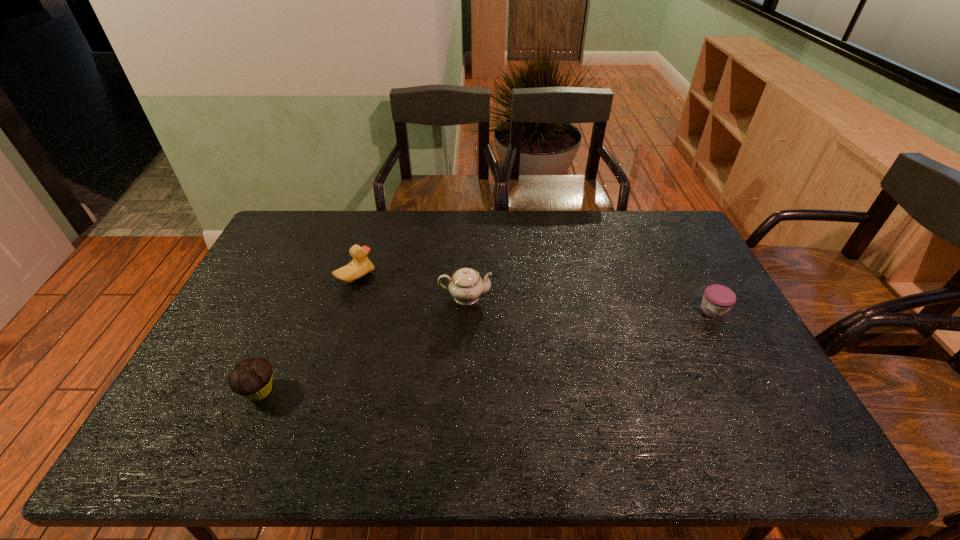
I want to click on object that is at the left edge, so pos(252,377).

Find the location of a particular element. The width and height of the screenshot is (960, 540). object that is at the right edge is located at coordinates point(718,299).

What are the coordinates of `free space at the far edge` in the screenshot? It's located at (421, 213).

At what (x,y) coordinates should I click in order to perform the action: click on free space at the near edge of the desktop. Please return your answer as a coordinate pair (x, y). The height and width of the screenshot is (540, 960). Looking at the image, I should click on (392, 427).

I want to click on vacant space at the left edge of the desktop, so click(x=286, y=269).

Locate an element on the screen. The height and width of the screenshot is (540, 960). vacant space at the right edge is located at coordinates (658, 254).

In the image, there is a desktop. At what (x,y) coordinates should I click in order to perform the action: click on free region at the near left corner. Please return your answer as a coordinate pair (x, y). The height and width of the screenshot is (540, 960). Looking at the image, I should click on (146, 464).

The height and width of the screenshot is (540, 960). In order to click on vacant space at the far right corner in this screenshot , I will do click(x=661, y=241).

At what (x,y) coordinates should I click in order to perform the action: click on free space that is in between the chinaware and the rightmost object. Please return your answer as a coordinate pair (x, y). The width and height of the screenshot is (960, 540). Looking at the image, I should click on (589, 303).

At what (x,y) coordinates should I click in order to perform the action: click on vacant area that lies between the second object from left to right and the leftmost object. Please return your answer as a coordinate pair (x, y). The height and width of the screenshot is (540, 960). Looking at the image, I should click on (307, 334).